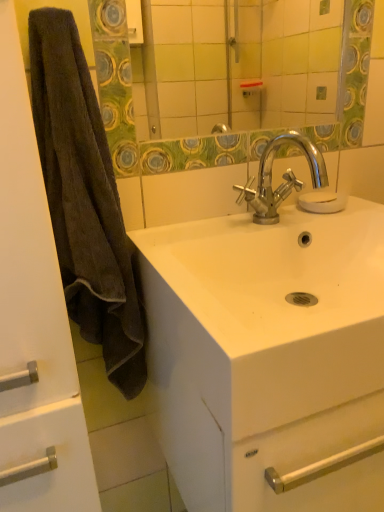
The height and width of the screenshot is (512, 384). I want to click on vacant space to the left of chrome metallic faucet at center, so [191, 238].